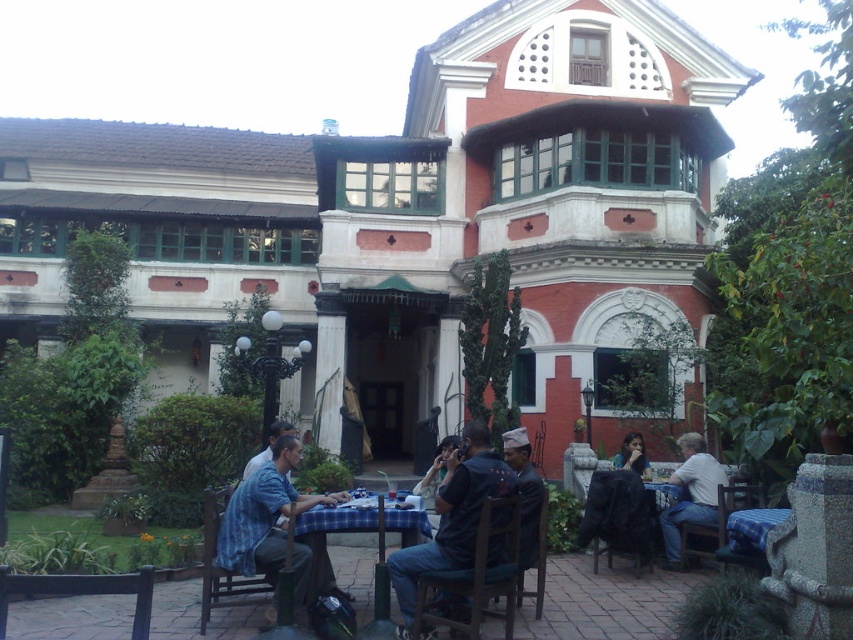
Question: Among these objects, which one is farthest from the camera?

Choices:
 (A) blue striped shirt at lower left
 (B) blue fabric table at lower right

Answer: (B)

Question: Does blue striped shirt at lower left have a lesser width compared to matte black shirt at center?

Choices:
 (A) yes
 (B) no

Answer: (B)

Question: Is dark blue shirt at center positioned at the back of matte black shirt at center?

Choices:
 (A) no
 (B) yes

Answer: (A)

Question: Can you confirm if blue plaid tablecloth at center is positioned to the right of light blue shirt at center?

Choices:
 (A) no
 (B) yes

Answer: (A)

Question: Which of the following is the farthest from the observer?

Choices:
 (A) (630, 448)
 (B) (465, 600)
 (C) (250, 497)

Answer: (A)

Question: Which of the following is the farthest from the observer?

Choices:
 (A) blue striped shirt at lower left
 (B) matte black shirt at center
 (C) blue denim shirt at lower left
 (D) light blue shirt at center

Answer: (B)